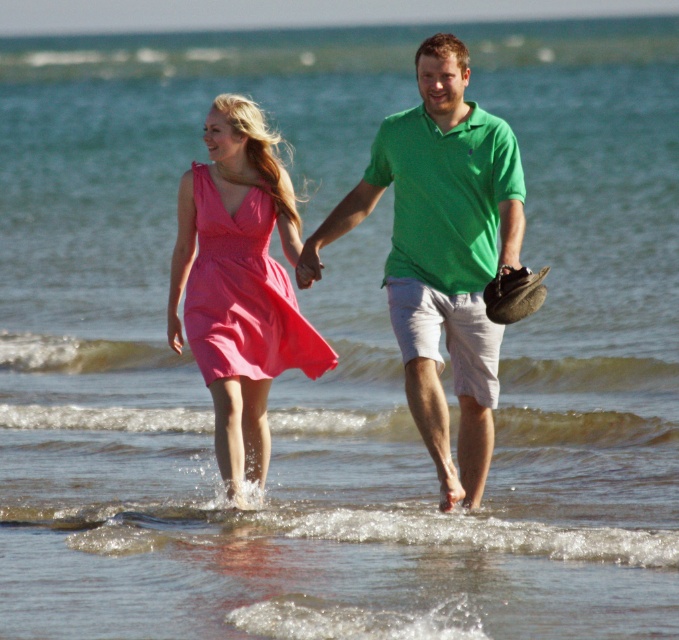
You are a photographer at the beach scene. You need to adjust your camera focus to capture both the pink satin dress at center and the matte pink fabric dress at center. Which dress should you focus on first if you want to ensure the one closer to the camera is sharp?

The pink satin dress at center is located below the matte pink fabric dress at center, so the matte pink fabric dress at center is closer to the camera. Focus on the matte pink fabric dress at center first to ensure it is sharp.

You are a photographer trying to capture a photo of the two people in the beach scene. You want to ensure both the green cotton polo shirt at center and the matte pink fabric dress at center are visible in the frame. Based on their heights, which clothing item will appear larger in the photo?

The green cotton polo shirt at center is much taller than the matte pink fabric dress at center, so it will appear larger in the photo.